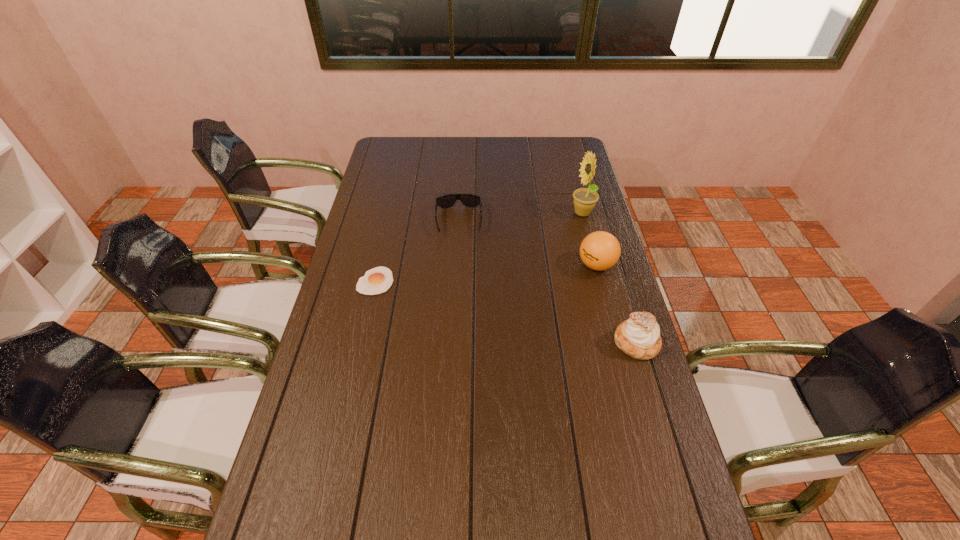
Locate an element on the screen. This screenshot has height=540, width=960. vacant region located on the side with brand of the ping-pong ball is located at coordinates [479, 302].

Identify the location of free space located 0.080m on the side with brand of the ping-pong ball. (559, 277).

Where is `free space located on the front-facing side of the second object from left to right`? The image size is (960, 540). free space located on the front-facing side of the second object from left to right is located at coordinates (460, 251).

Locate an element on the screen. Image resolution: width=960 pixels, height=540 pixels. vacant point located 0.380m on the front-facing side of the second object from left to right is located at coordinates (461, 320).

The image size is (960, 540). Find the location of `free location located 0.120m on the front-facing side of the second object from left to right`. free location located 0.120m on the front-facing side of the second object from left to right is located at coordinates (460, 261).

The width and height of the screenshot is (960, 540). In order to click on vacant space located on the face of the sunflower in this screenshot , I will do `click(561, 232)`.

In order to click on free space located 0.200m on the face of the sunflower in this screenshot , I will do `click(541, 246)`.

Identify the location of free space located 0.290m on the face of the sunflower. Image resolution: width=960 pixels, height=540 pixels. (525, 258).

You are a GUI agent. You are given a task and a screenshot of the screen. Output one action in this format:
    pyautogui.click(x=<x>, y=<y>)
    Task: Click on the object that is at the left edge
    The width and height of the screenshot is (960, 540).
    Given the screenshot: What is the action you would take?
    pyautogui.click(x=378, y=280)

This screenshot has height=540, width=960. Find the location of `pastry present at the right edge`. pastry present at the right edge is located at coordinates (639, 337).